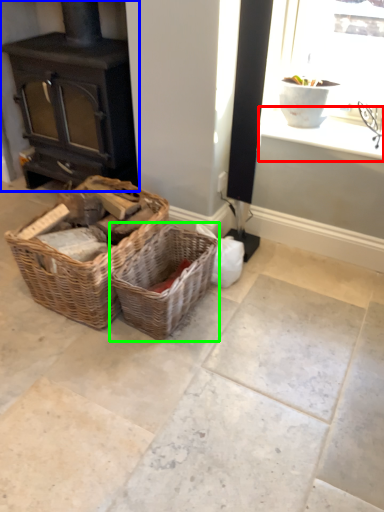
Question: Which object is positioned farthest from window sill (highlighted by a red box)? Select from wood burning stove (highlighted by a blue box) and picnic basket (highlighted by a green box).

Choices:
 (A) wood burning stove
 (B) picnic basket

Answer: (A)